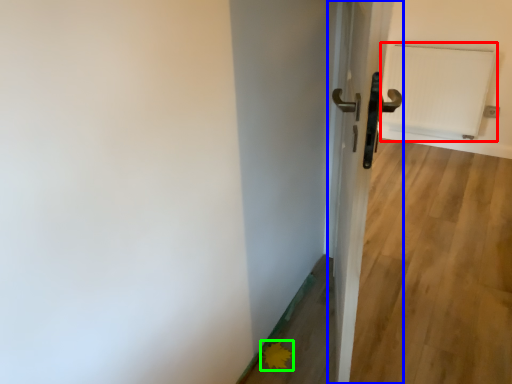
Question: Based on their relative distances, which object is nearer to radiator (highlighted by a red box)? Choose from door (highlighted by a blue box) and flower (highlighted by a green box).

Choices:
 (A) door
 (B) flower

Answer: (A)